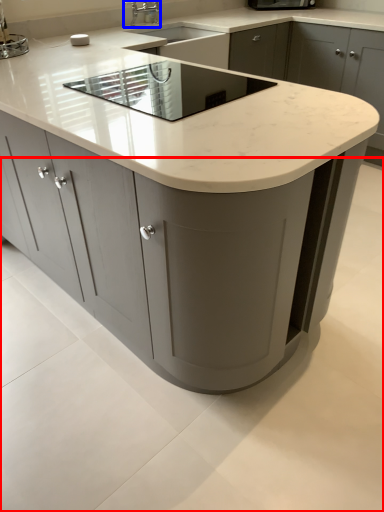
Question: Which point is further to the camera, concrete (highlighted by a red box) or tap (highlighted by a blue box)?

Choices:
 (A) concrete
 (B) tap

Answer: (B)